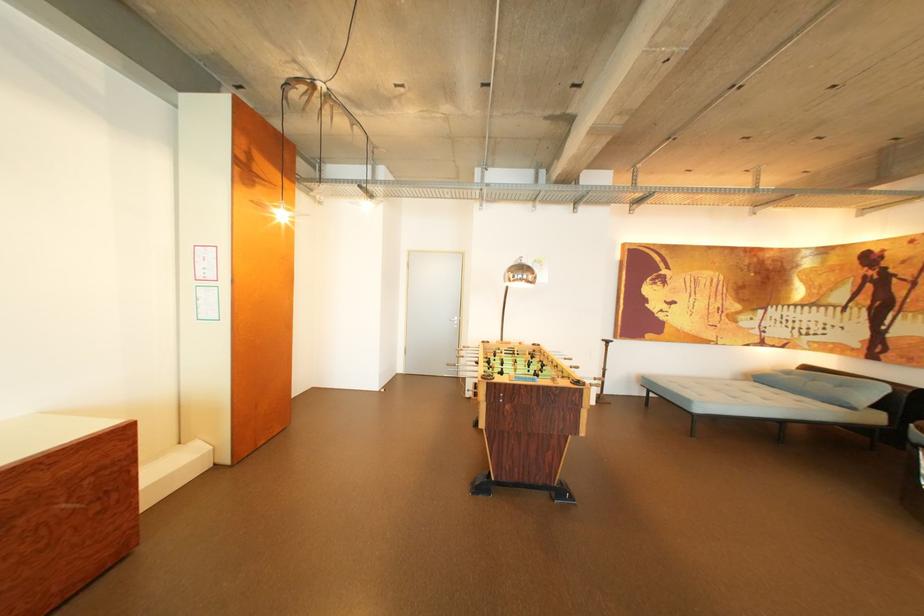
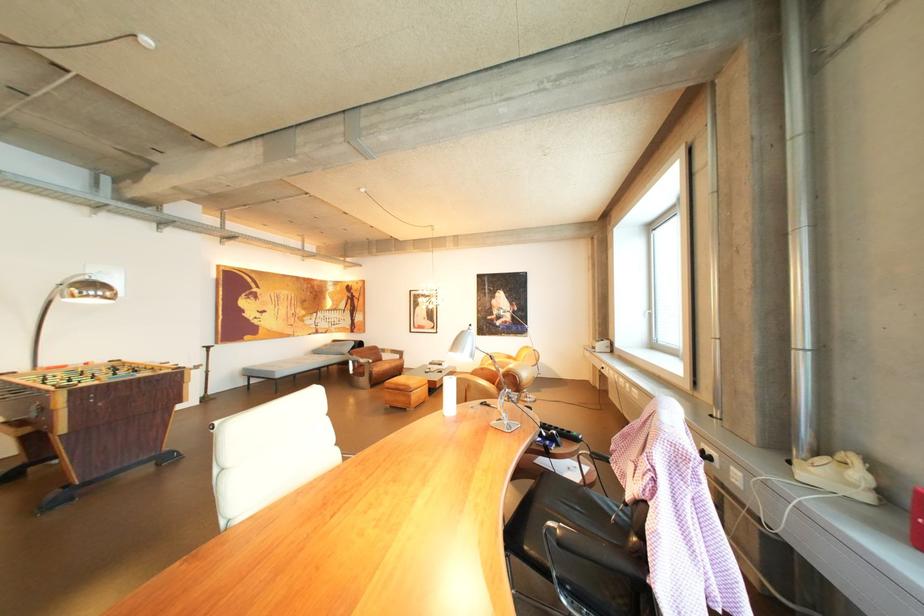
Locate, in the second image, the point that corresponds to the point at 533,277 in the first image.

(105, 294)